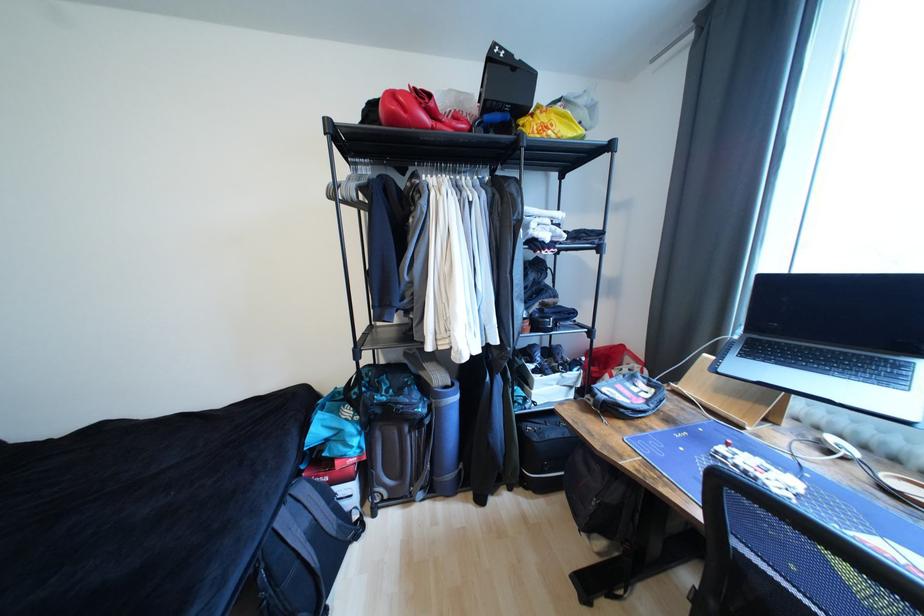
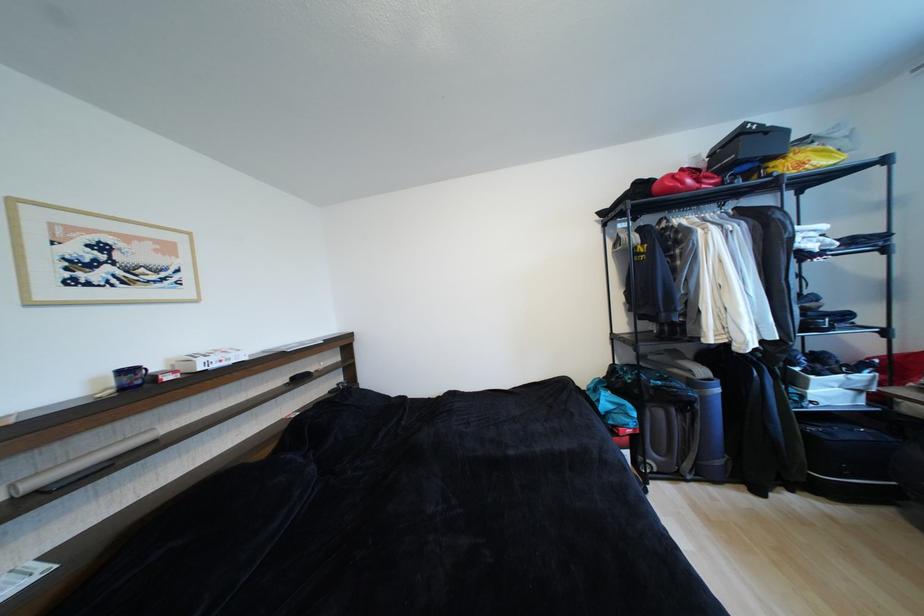
Based on the photo, the images are taken continuously from a first-person perspective. In which direction are you moving?

The cameraman walked toward left, backward.